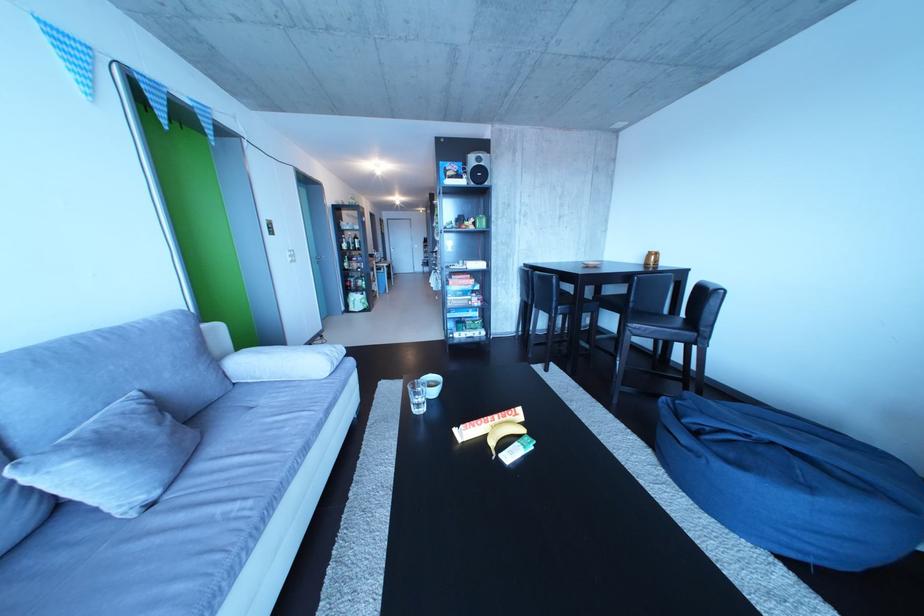
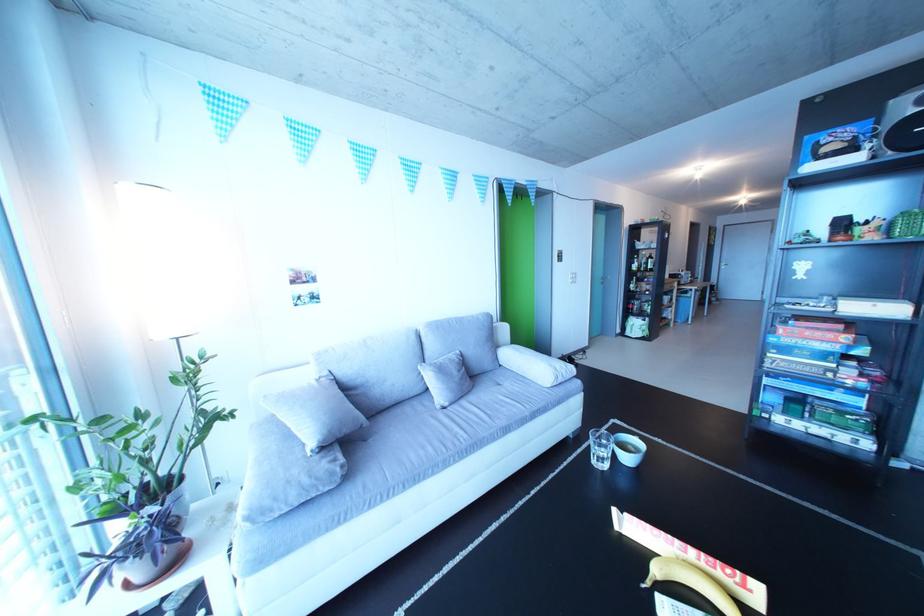
Question: The camera is either moving clockwise (left) or counter-clockwise (right) around the object. The first image is from the beginning of the video and the second image is from the end. Is the camera moving left or right when shooting the video?

Choices:
 (A) Left
 (B) Right

Answer: (B)